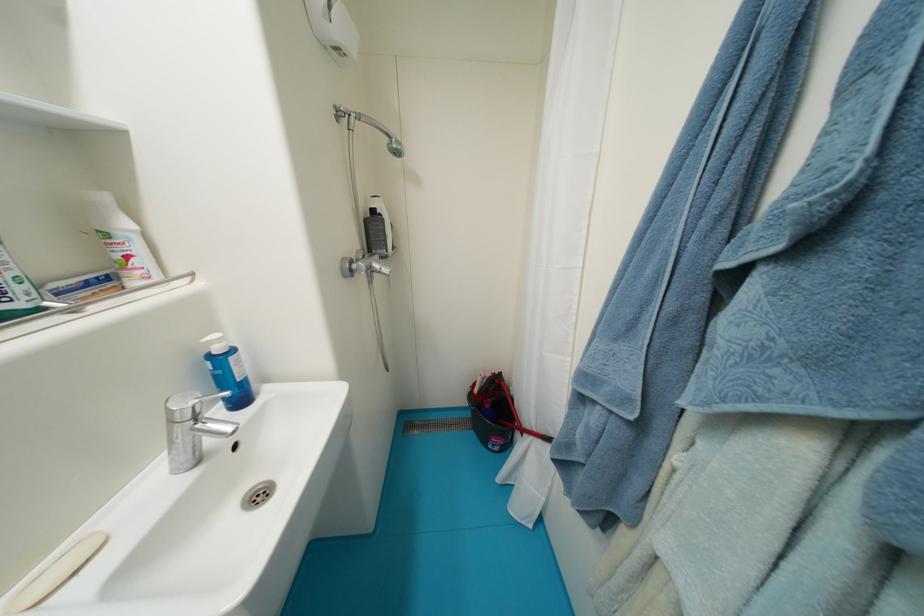
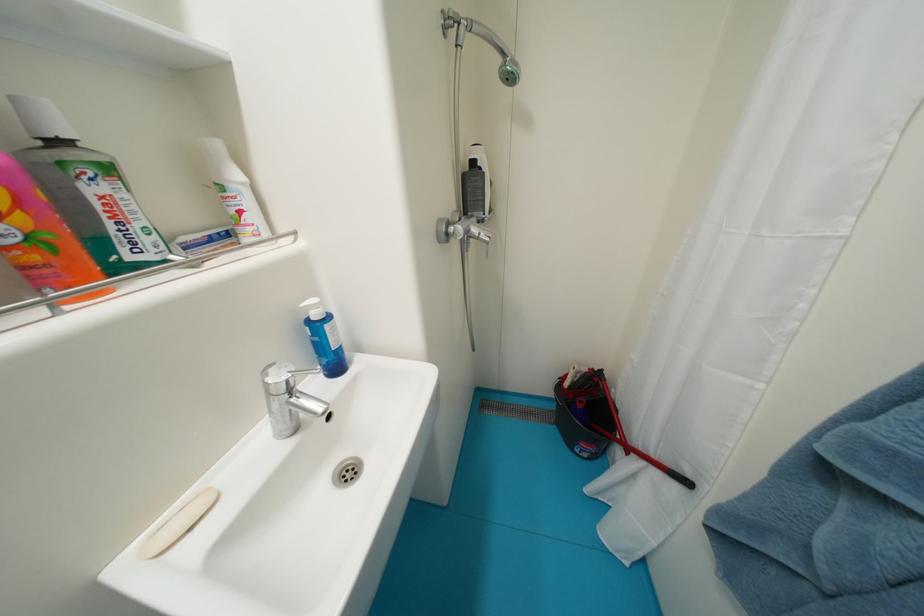
Question: The camera is either moving clockwise (left) or counter-clockwise (right) around the object. The first image is from the beginning of the video and the second image is from the end. Is the camera moving left or right when shooting the video?

Choices:
 (A) Left
 (B) Right

Answer: (B)